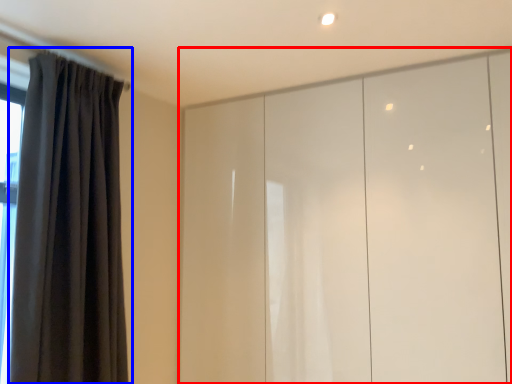
Question: Among these objects, which one is nearest to the camera, cupboard (highlighted by a red box) or curtain (highlighted by a blue box)?

Choices:
 (A) cupboard
 (B) curtain

Answer: (B)